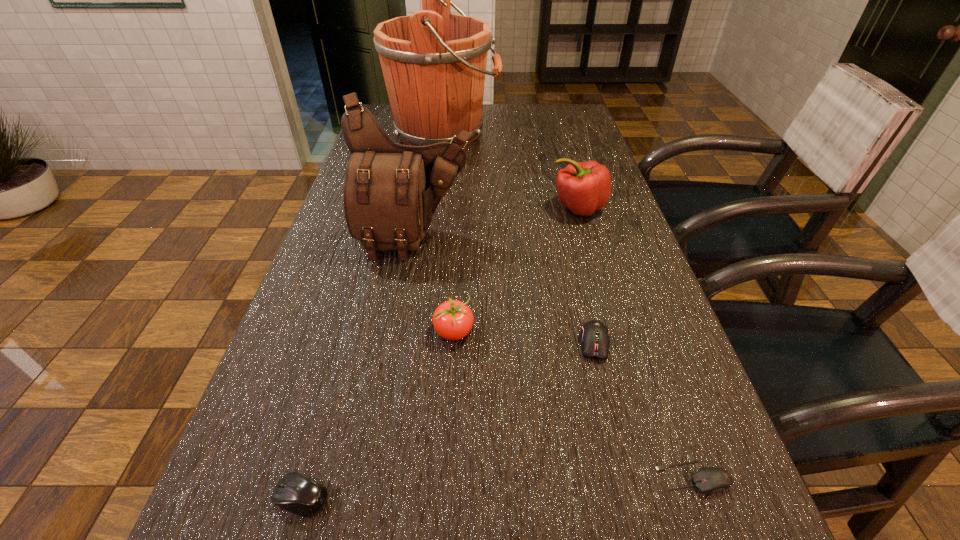
Where is `bell pepper situated at the right edge`? bell pepper situated at the right edge is located at coordinates (584, 187).

I want to click on object that is at the far left corner, so click(x=434, y=63).

This screenshot has width=960, height=540. Identify the location of vacant region at the far edge. (499, 130).

The width and height of the screenshot is (960, 540). In order to click on free space at the left edge in this screenshot , I will do `click(302, 350)`.

Where is `free location at the right edge`? The height and width of the screenshot is (540, 960). free location at the right edge is located at coordinates (616, 203).

In the image, there is a desktop. Identify the location of vacant space at the far right corner. (577, 107).

Identify the location of free space between the bucket and the rightmost mouse. Image resolution: width=960 pixels, height=540 pixels. (568, 305).

At what (x,y) coordinates should I click in order to perform the action: click on empty space that is in between the rightmost mouse and the bucket. Please return your answer as a coordinate pair (x, y). Looking at the image, I should click on (568, 305).

You are a GUI agent. You are given a task and a screenshot of the screen. Output one action in this format:
    pyautogui.click(x=<x>, y=<y>)
    Task: Click on the vacant point located between the second tallest object and the tomato
    This screenshot has height=540, width=960.
    Given the screenshot: What is the action you would take?
    pyautogui.click(x=435, y=285)

Where is `unoccupied position between the fourth tallest object and the second mouse from right to left`? Image resolution: width=960 pixels, height=540 pixels. unoccupied position between the fourth tallest object and the second mouse from right to left is located at coordinates (524, 338).